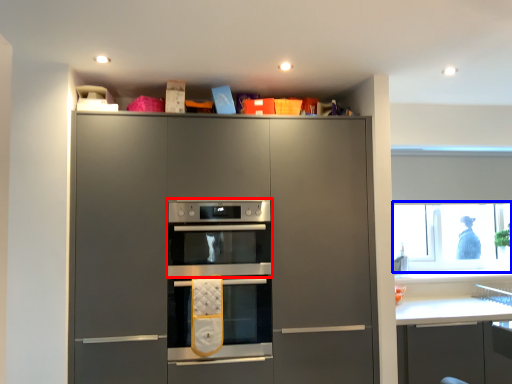
Question: Among these objects, which one is nearest to the camera, oven (highlighted by a red box) or window screen (highlighted by a blue box)?

Choices:
 (A) oven
 (B) window screen

Answer: (A)